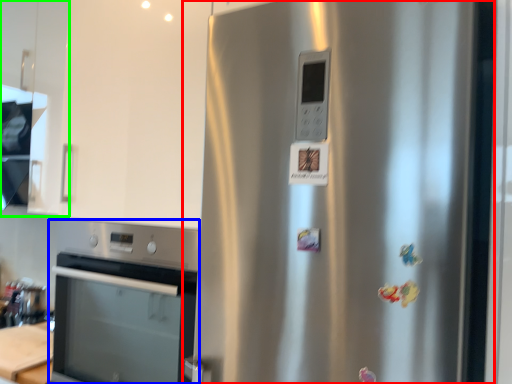
Question: Which object is the farthest from refrigerator (highlighted by a red box)? Choose among these: home appliance (highlighted by a blue box) or cabinetry (highlighted by a green box).

Choices:
 (A) home appliance
 (B) cabinetry

Answer: (B)